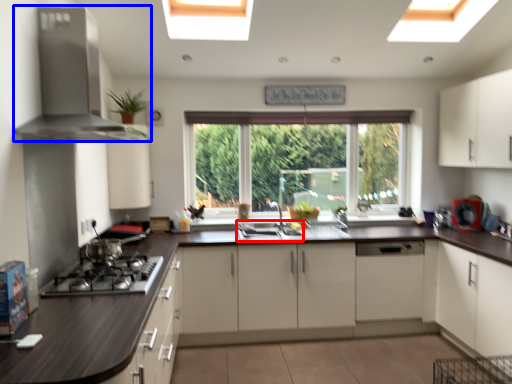
Question: Which object is closer to the camera taking this photo, sink (highlighted by a red box) or kitchen appliance (highlighted by a blue box)?

Choices:
 (A) sink
 (B) kitchen appliance

Answer: (B)